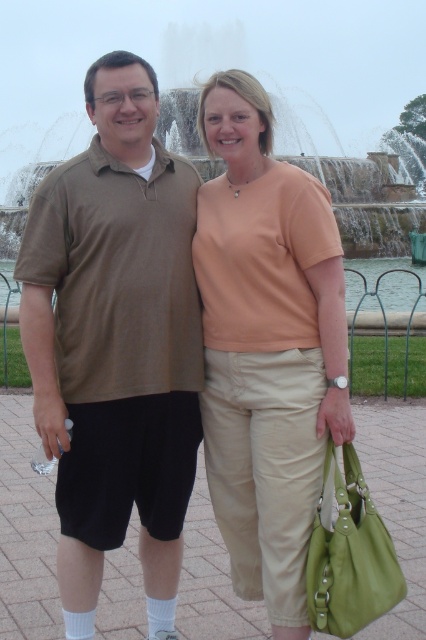
Question: Which is nearer to the brown cotton shirt at left?

Choices:
 (A) beige cotton shirt at center
 (B) frosted glass water at center

Answer: (A)

Question: Is brown cotton shirt at left positioned at the back of frosted glass water at center?

Choices:
 (A) no
 (B) yes

Answer: (A)

Question: Is beige cotton shirt at center bigger than frosted glass water at center?

Choices:
 (A) yes
 (B) no

Answer: (B)

Question: Does brown cotton shirt at left lie behind frosted glass water at center?

Choices:
 (A) yes
 (B) no

Answer: (B)

Question: Which of the following is the farthest from the observer?

Choices:
 (A) (261, 225)
 (B) (316, 42)
 (C) (86, 74)

Answer: (B)

Question: Which object appears farthest from the camera in this image?

Choices:
 (A) frosted glass water at center
 (B) beige cotton shirt at center

Answer: (A)